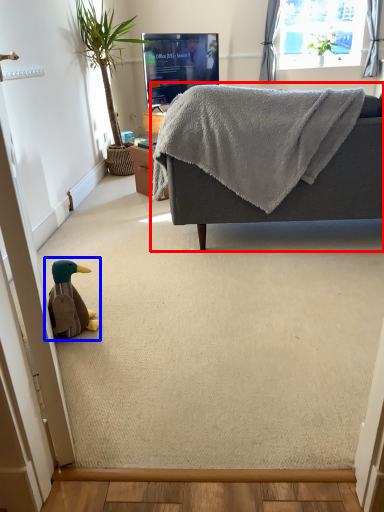
Question: Among these objects, which one is nearest to the camera, studio couch (highlighted by a red box) or toy (highlighted by a blue box)?

Choices:
 (A) studio couch
 (B) toy

Answer: (B)